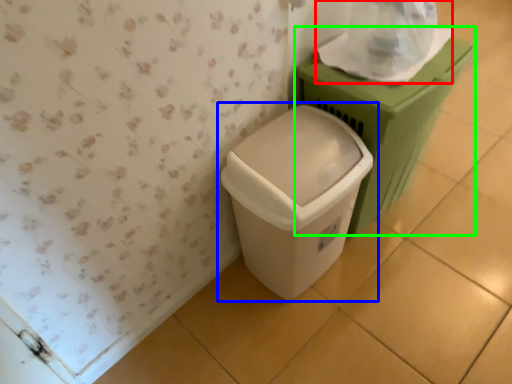
Question: Which object is the closest to the toilet paper (highlighted by a red box)? Choose among these: waste container (highlighted by a blue box) or waste container (highlighted by a green box).

Choices:
 (A) waste container
 (B) waste container

Answer: (B)